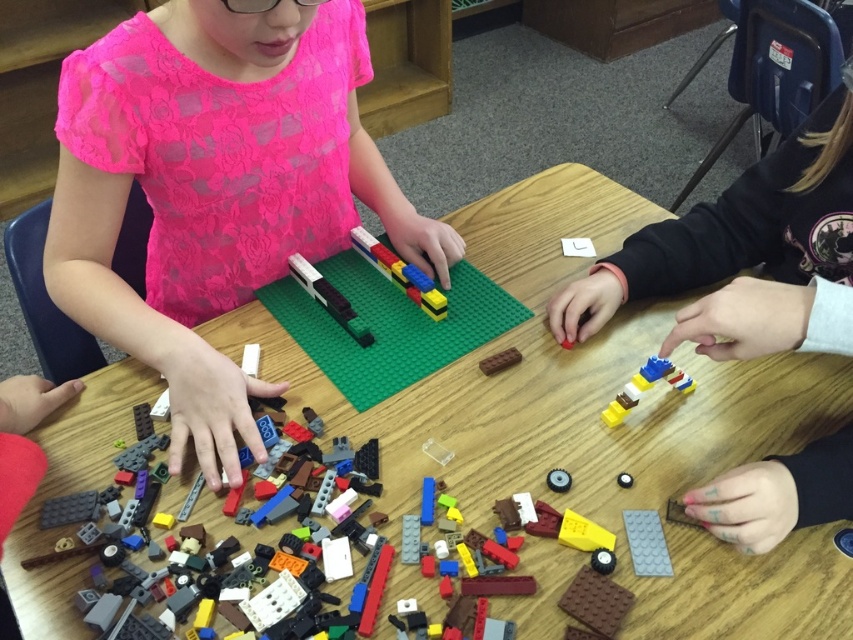
Which of these two, translucent plastic brick at center or metallic silver gear at center, stands shorter?

With less height is metallic silver gear at center.

Which of these two, translucent plastic brick at center or metallic silver gear at center, stands taller?

translucent plastic brick at center

What do you see at coordinates (646, 541) in the screenshot?
I see `translucent plastic brick at center` at bounding box center [646, 541].

You are a GUI agent. You are given a task and a screenshot of the screen. Output one action in this format:
    pyautogui.click(x=<x>, y=<y>)
    Task: Click on the translucent plastic brick at center
    
    Given the screenshot: What is the action you would take?
    pyautogui.click(x=646, y=541)

Between pink lace shirt at upper left and brown matte brick at center, which one is positioned higher?

pink lace shirt at upper left is above.

Which of these two, pink lace shirt at upper left or brown matte brick at center, stands shorter?

brown matte brick at center

Image resolution: width=853 pixels, height=640 pixels. I want to click on pink lace shirt at upper left, so click(x=216, y=188).

In the scene shown: Can you confirm if wooden table at center is positioned to the right of translucent plastic lego brick at center?

Yes, wooden table at center is to the right of translucent plastic lego brick at center.

Which of these two, wooden table at center or translucent plastic lego brick at center, stands shorter?

translucent plastic lego brick at center

Between point (763, 577) and point (367, 328), which one is positioned behind?

Positioned behind is point (367, 328).

Where is `wooden table at center`? Image resolution: width=853 pixels, height=640 pixels. wooden table at center is located at coordinates (596, 420).